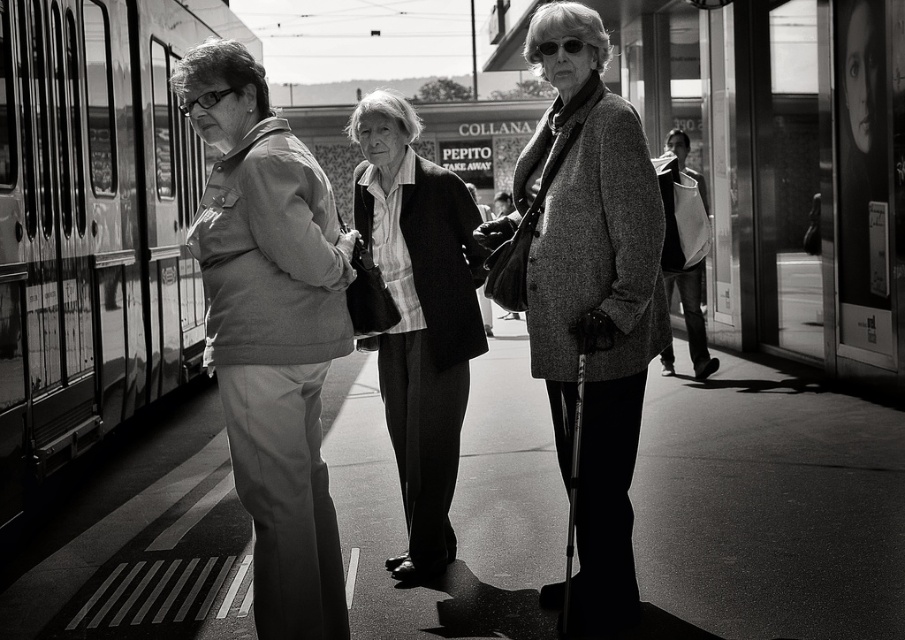
Is textured gray coat at center above white cotton jacket at right?

Actually, textured gray coat at center is below white cotton jacket at right.

Can you confirm if textured gray coat at center is positioned to the left of white cotton jacket at right?

Indeed, textured gray coat at center is positioned on the left side of white cotton jacket at right.

Who is more distant from viewer, (586, 296) or (697, 316)?

The point (697, 316) is behind.

The image size is (905, 640). I want to click on textured gray coat at center, so click(x=592, y=292).

Consider the image. Is metallic train at left closer to camera compared to textured gray coat at center?

That is False.

Does point (49, 138) come closer to viewer compared to point (570, 312)?

No, (49, 138) is behind (570, 312).

The width and height of the screenshot is (905, 640). In order to click on metallic train at left in this screenshot , I will do `click(93, 221)`.

Measure the distance between point (639, 372) and camera.

3.93 meters

Does matte gray sweater at center have a smaller size compared to metallic train at left?

No.

Between point (369, 129) and point (132, 348), which one is positioned behind?

Positioned behind is point (132, 348).

Where is `matte gray sweater at center`? matte gray sweater at center is located at coordinates (555, 316).